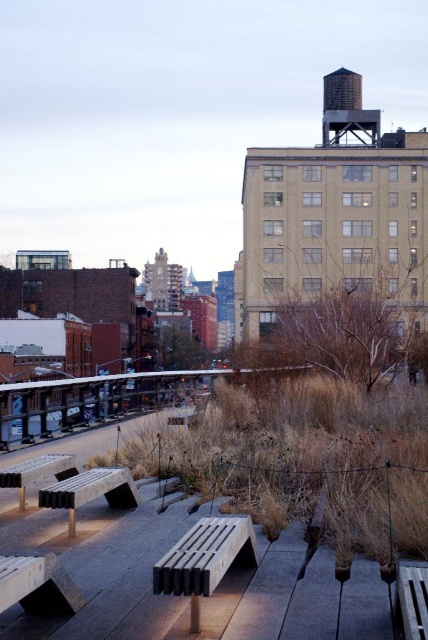
You are a visitor at the rooftop garden and want to sit on the bench closest to the edge. Which bench should you choose between the matte gray bench at center and the wooden park bench at lower right?

The wooden park bench at lower right is closer to the edge of the rooftop garden, so you should choose the wooden park bench at lower right.

You are a visitor standing at the edge of the rooftop garden looking towards the benches. Which bench, the matte gray bench at center or the wooden park bench at lower right, is positioned closer to you?

The wooden park bench at lower right is closer to you since it is above the matte gray bench at center, indicating it is nearer in the visual perspective.